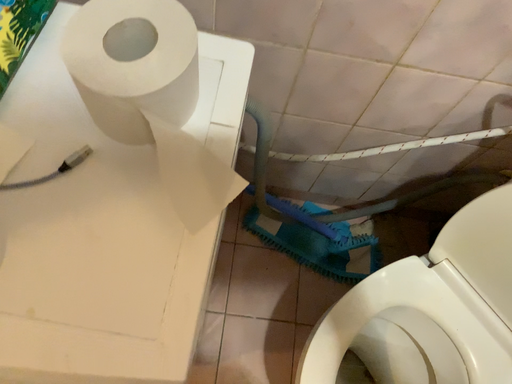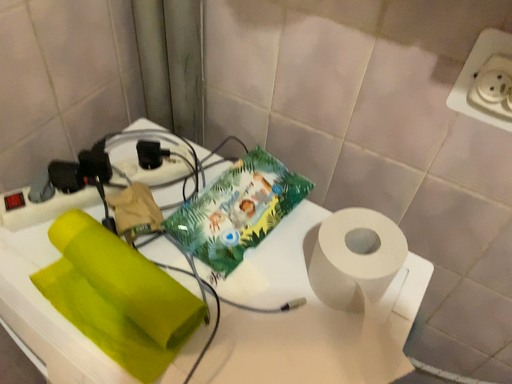
Question: Which way did the camera rotate in the video?

Choices:
 (A) rotated left
 (B) rotated right

Answer: (A)